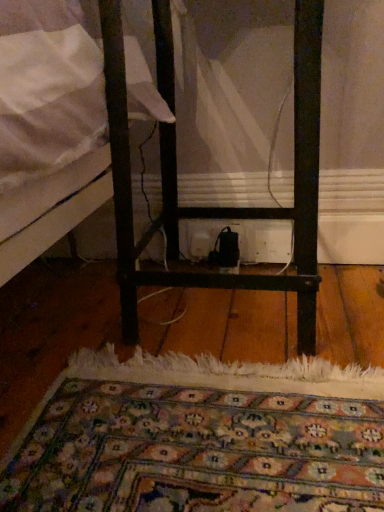
Find the location of a particular element. The width and height of the screenshot is (384, 512). free point in front of black metal nightstand at center is located at coordinates (222, 411).